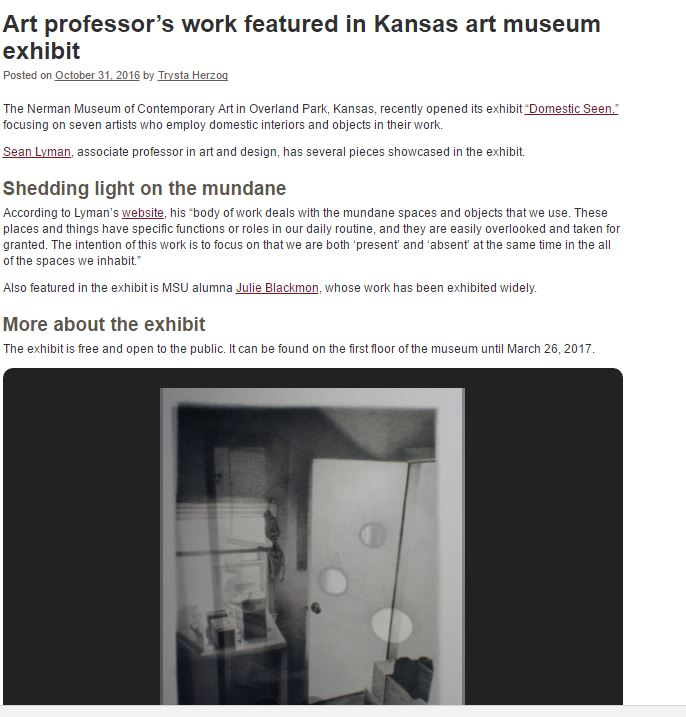
You are a GUI agent. You are given a task and a screenshot of the screen. Output one action in this format:
    pyautogui.click(x=<x>, y=<y>)
    Task: Click on the window
    
    Given the screenshot: What is the action you would take?
    pyautogui.click(x=215, y=578)